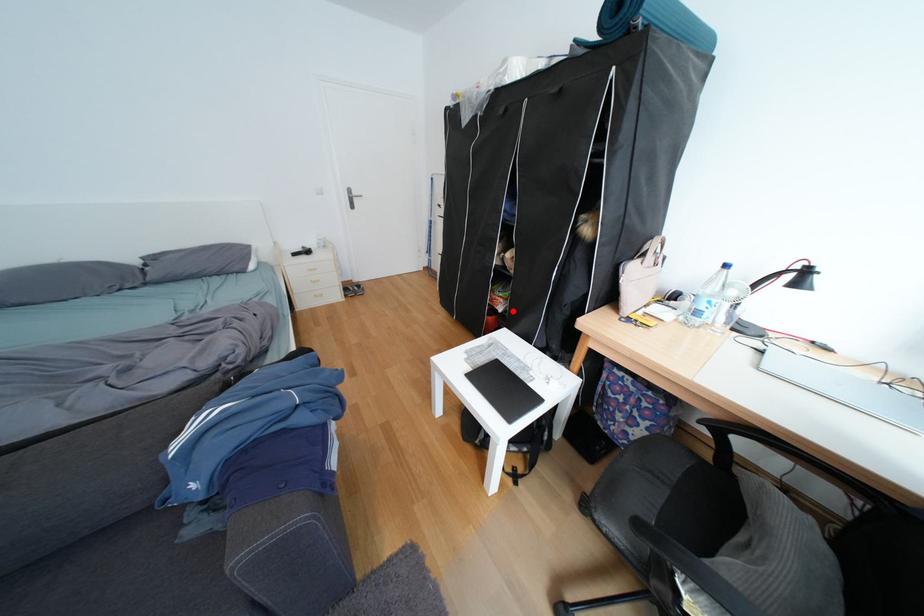
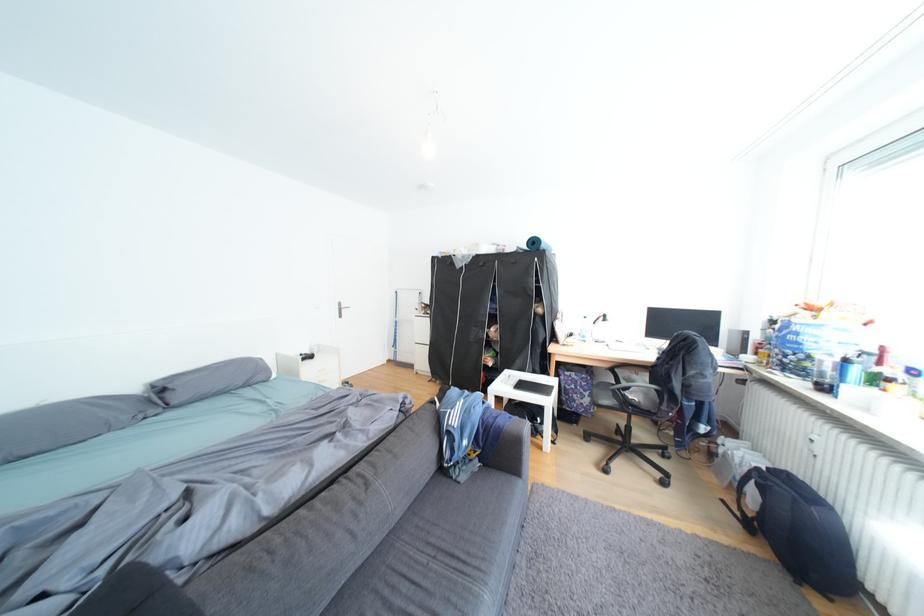
Where in the second image is the point corresponding to the highlighted location from the first image?

(504, 365)